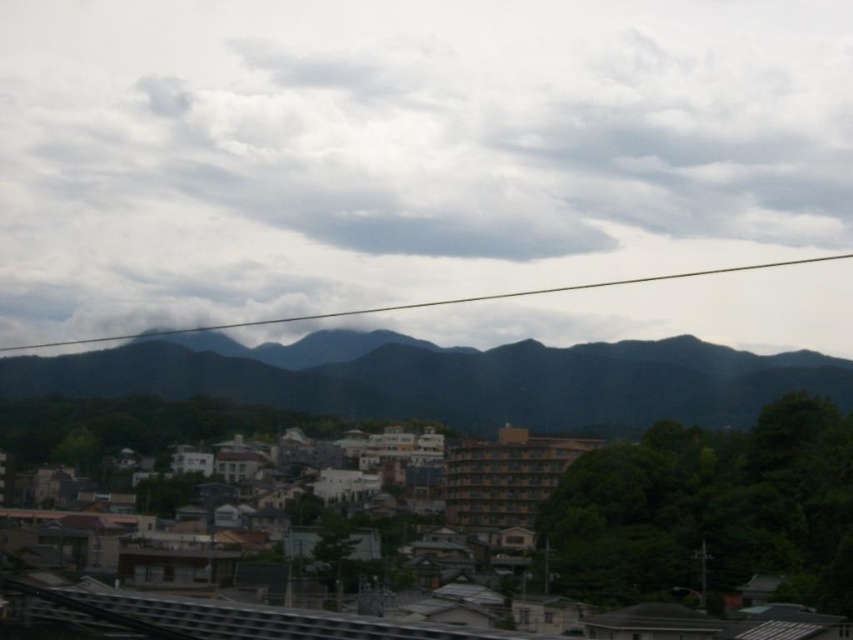
Question: Can you confirm if cloudy sky at upper center is smaller than dark green textured mountains at center?

Choices:
 (A) no
 (B) yes

Answer: (A)

Question: From the image, what is the correct spatial relationship of dark green textured mountains at center in relation to transparent wire at upper center?

Choices:
 (A) right
 (B) left

Answer: (B)

Question: Where is dark green textured mountains at center located in relation to transparent wire at upper center in the image?

Choices:
 (A) right
 (B) left

Answer: (B)

Question: Which point is farther from the camera taking this photo?

Choices:
 (A) (589, 355)
 (B) (96, 342)
 (C) (431, 163)

Answer: (C)

Question: Which of the following is the farthest from the observer?

Choices:
 (A) (816, 259)
 (B) (775, 324)
 (C) (454, 371)

Answer: (A)

Question: Which is farther from the dark green textured mountains at center?

Choices:
 (A) cloudy sky at upper center
 (B) transparent wire at upper center

Answer: (A)